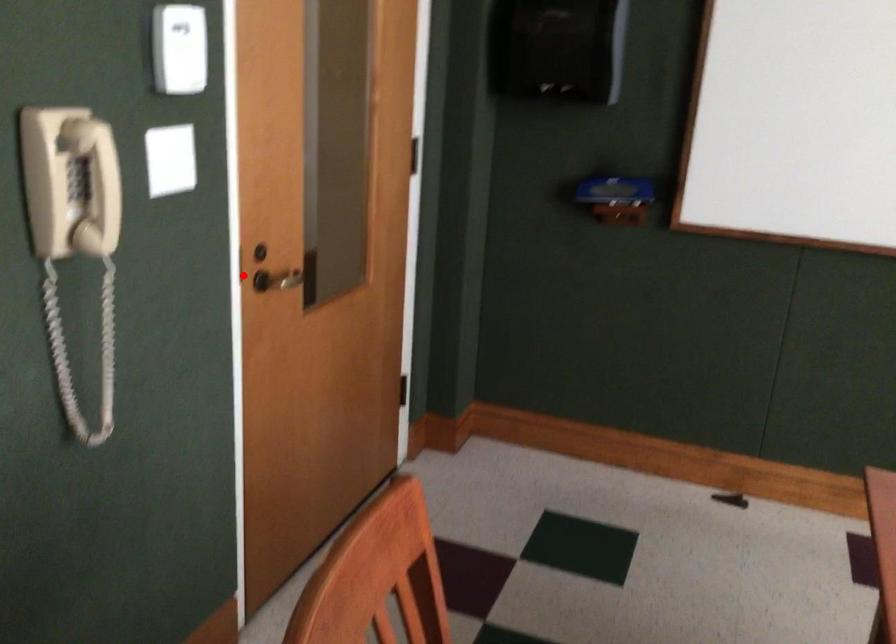
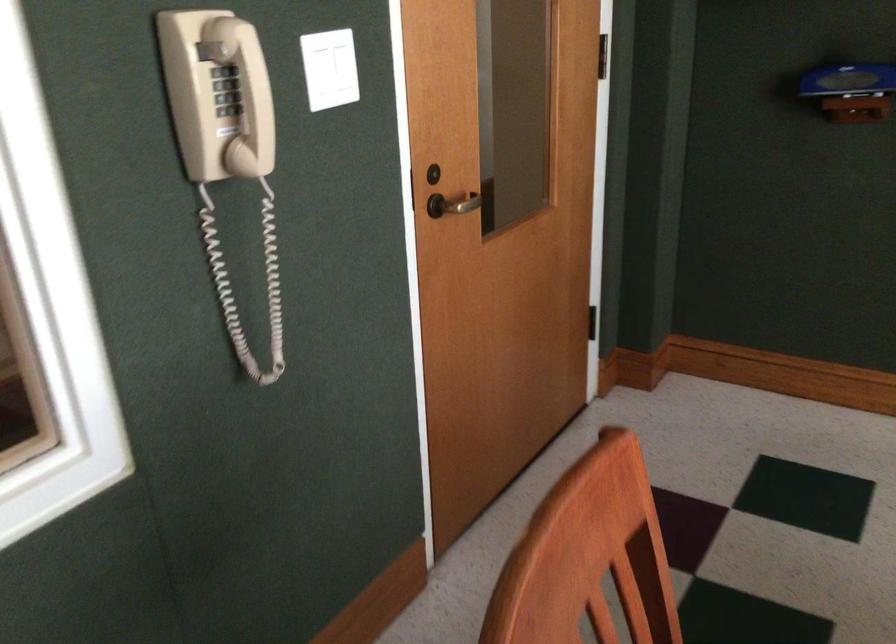
Question: I am providing you with two images of the same scene from different viewpoints. Given a red point in image1, look at the same physical point in image2. Is it:

Choices:
 (A) Closer to the viewpoint
 (B) Farther from the viewpoint

Answer: (A)